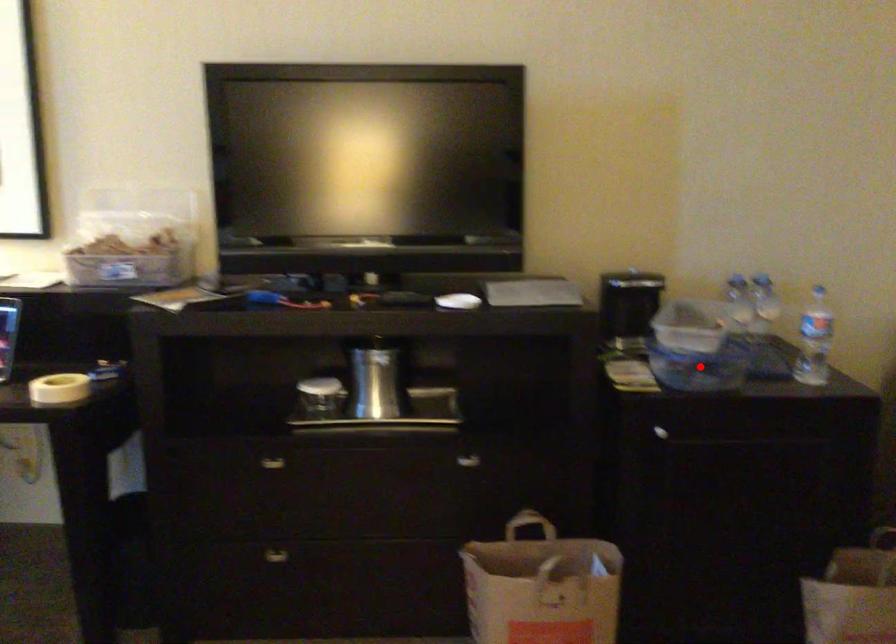
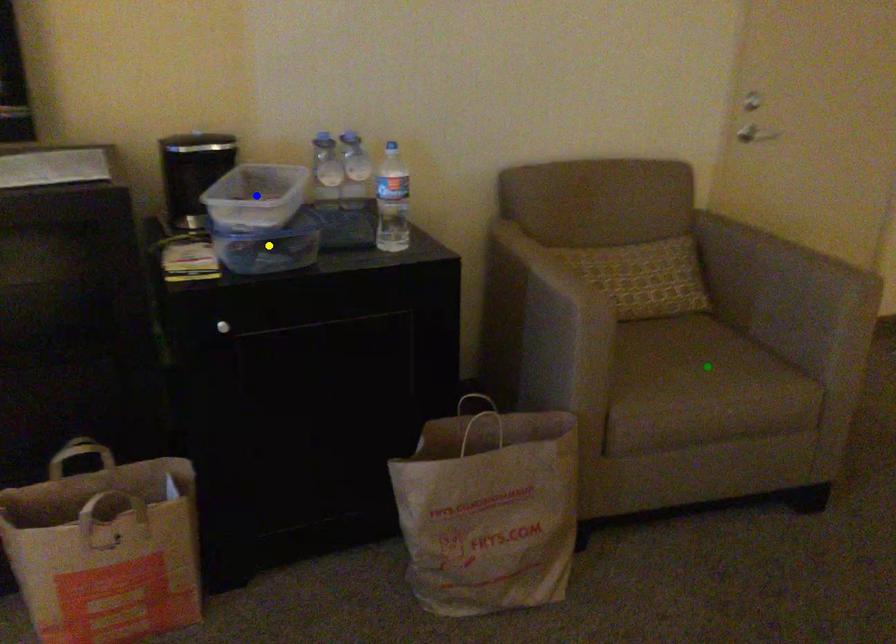
Question: I am providing you with two images of the same scene from different viewpoints. A red point is marked on the first image. You are given multiple points on the second image. Which mark in image 2 goes with the point in image 1?

Choices:
 (A) blue point
 (B) green point
 (C) yellow point

Answer: (C)